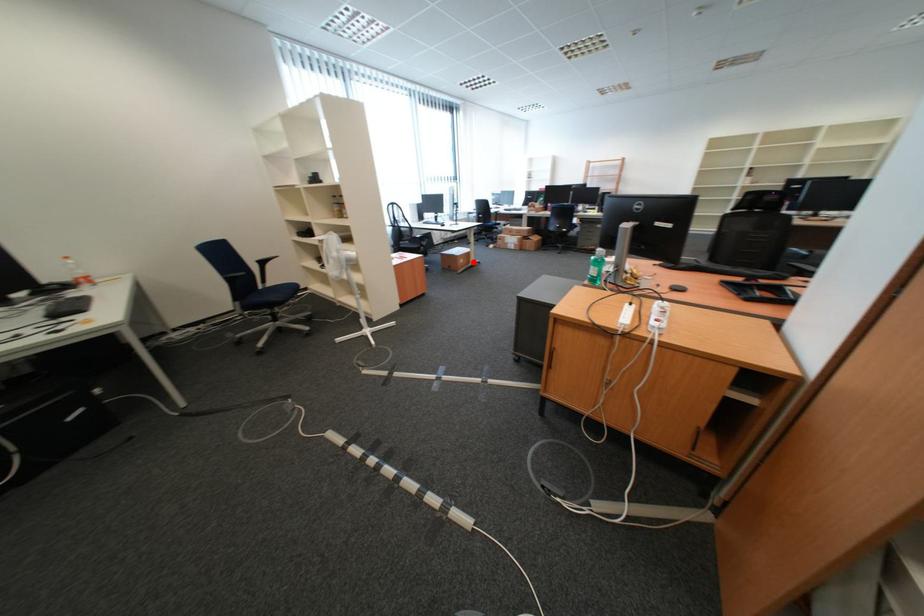
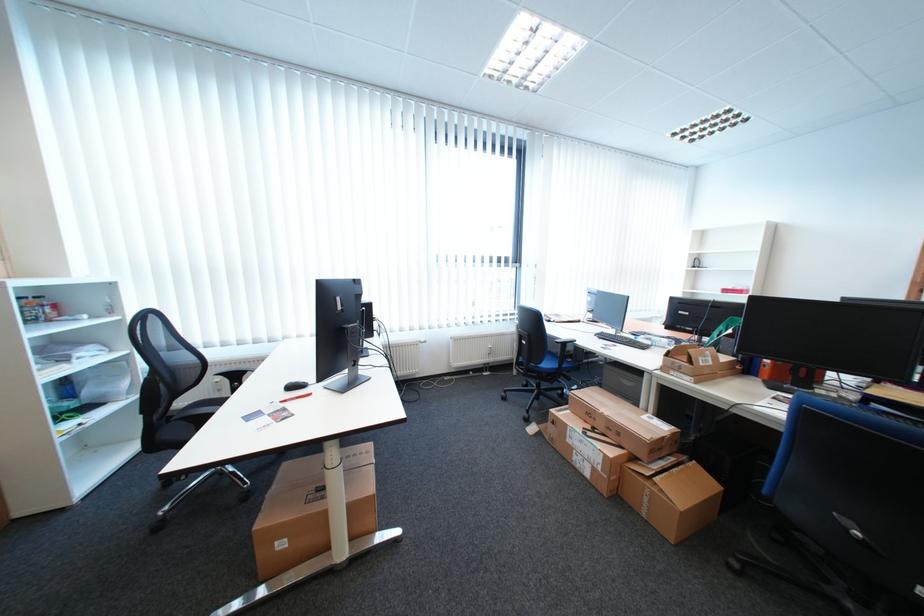
The point at the highlighted location is marked in the first image. Where is the corresponding point in the second image?

(294, 546)